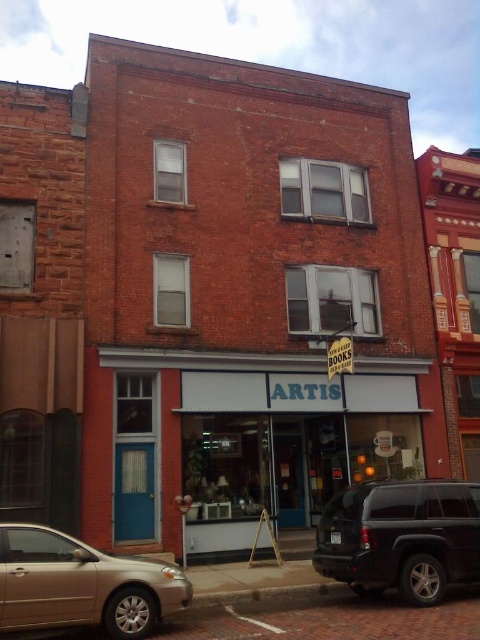
Does shiny black suv at center have a greater width compared to gold metallic sedan at lower left?

Indeed, shiny black suv at center has a greater width compared to gold metallic sedan at lower left.

In the scene shown: Who is more distant from viewer, (411, 572) or (96, 561)?

The point (411, 572) is behind.

Locate an element on the screen. This screenshot has width=480, height=640. shiny black suv at center is located at coordinates (402, 538).